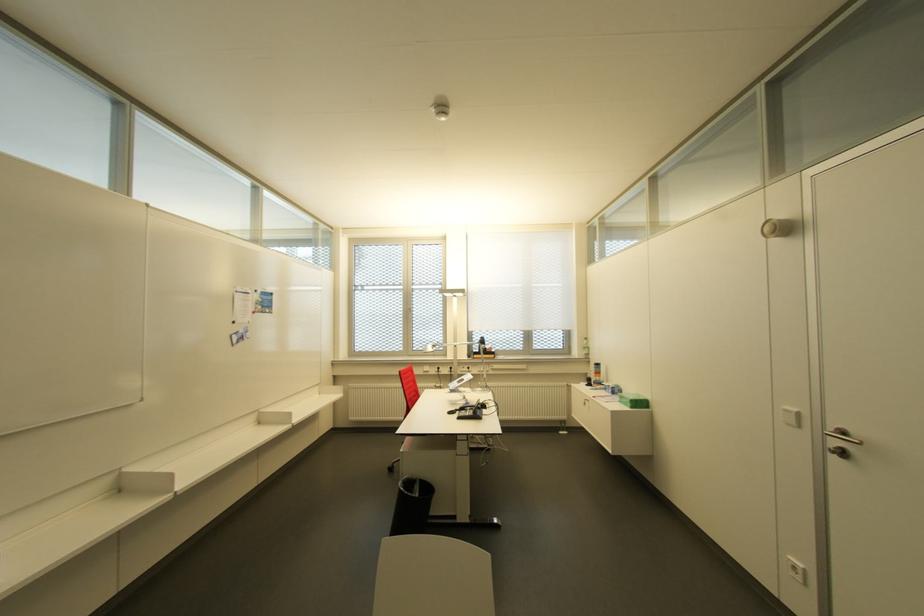
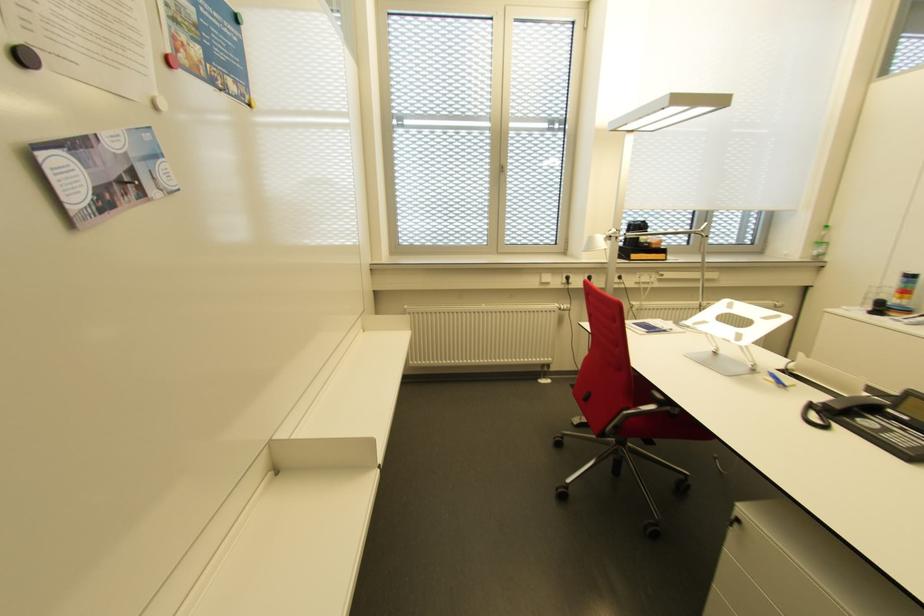
In a continuous first-person perspective shot, in which direction is the camera moving?

The cameraman moved toward left, forward.